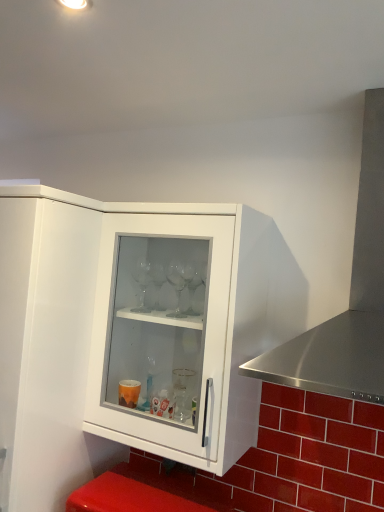
Find the location of a particular element. The height and width of the screenshot is (512, 384). transparent glass cabinet at center is located at coordinates (161, 332).

Find the location of a particular element. The image size is (384, 512). transparent glass cabinet at center is located at coordinates (161, 332).

Between white glossy cabinet at upper left and transparent glass cabinet at center, which one has more height?

white glossy cabinet at upper left.

Are white glossy cabinet at upper left and transparent glass cabinet at center making contact?

No, white glossy cabinet at upper left is not next to transparent glass cabinet at center.

The image size is (384, 512). Identify the location of cupboard below the transparent glass cabinet at center (from a real-world perspective). (45, 347).

Is the depth of white glossy cabinet at upper left greater than that of transparent glass cabinet at center?

No, white glossy cabinet at upper left is in front of transparent glass cabinet at center.

From the image's perspective, which is below, transparent glass cabinet at center or white glossy cabinet at upper left?

white glossy cabinet at upper left, from the image's perspective.

Would you say white glossy cabinet at upper left is part of transparent glass cabinet at center's contents?

No.

Looking at this image, which object is positioned more to the right, transparent glass cabinet at center or white glossy cabinet at upper left?

transparent glass cabinet at center.

Looking at this image, is transparent glass cabinet at center facing away from white glossy cabinet at upper left?

transparent glass cabinet at center does not have its back to white glossy cabinet at upper left.

Based on their positions, is white glossy cabinet at upper left located to the left or right of stainless steel exhaust hood at right?

Clearly, white glossy cabinet at upper left is on the left of stainless steel exhaust hood at right in the image.

Consider the image. Who is smaller, white glossy cabinet at upper left or stainless steel exhaust hood at right?

With smaller size is stainless steel exhaust hood at right.

Which of these two, white glossy cabinet at upper left or stainless steel exhaust hood at right, is wider?

Wider between the two is white glossy cabinet at upper left.

Which is more to the left, transparent glass cabinet at center or stainless steel exhaust hood at right?

transparent glass cabinet at center is more to the left.

From their relative heights in the image, would you say transparent glass cabinet at center is taller or shorter than stainless steel exhaust hood at right?

Considering their sizes, transparent glass cabinet at center has more height than stainless steel exhaust hood at right.

Between transparent glass cabinet at center and stainless steel exhaust hood at right, which one is positioned behind?

transparent glass cabinet at center is behind.

From the image's perspective, which one is positioned higher, stainless steel exhaust hood at right or white glossy cabinet at upper left?

stainless steel exhaust hood at right is shown above in the image.

What's the angular difference between stainless steel exhaust hood at right and white glossy cabinet at upper left's facing directions?

The facing directions of stainless steel exhaust hood at right and white glossy cabinet at upper left are 0.706 degrees apart.

From a real-world perspective, is stainless steel exhaust hood at right on top of white glossy cabinet at upper left?

Yes, from a real-world perspective, stainless steel exhaust hood at right is on top of white glossy cabinet at upper left.

Do you think stainless steel exhaust hood at right is within white glossy cabinet at upper left, or outside of it?

stainless steel exhaust hood at right exists outside the volume of white glossy cabinet at upper left.

In terms of height, does stainless steel exhaust hood at right look taller or shorter compared to transparent glass cabinet at center?

In the image, stainless steel exhaust hood at right appears to be shorter than transparent glass cabinet at center.

Is stainless steel exhaust hood at right in front of or behind transparent glass cabinet at center in the image?

Clearly, stainless steel exhaust hood at right is in front of transparent glass cabinet at center.

Which is in front, point (363, 216) or point (199, 264)?

The point (363, 216) is more forward.

Is stainless steel exhaust hood at right smaller than transparent glass cabinet at center?

Actually, stainless steel exhaust hood at right might be larger than transparent glass cabinet at center.

Locate an element on the screen. Image resolution: width=384 pixels, height=512 pixels. glass door that appears on the right of white glossy cabinet at upper left is located at coordinates (161, 332).

Identify the location of glass door above the white glossy cabinet at upper left (from a real-world perspective). The height and width of the screenshot is (512, 384). (161, 332).

Estimate the real-world distances between objects in this image. Which object is closer to transparent glass cabinet at center, white glossy cabinet at upper left or stainless steel exhaust hood at right?

white glossy cabinet at upper left is closer to transparent glass cabinet at center.

Considering their positions, is stainless steel exhaust hood at right positioned closer to white glossy cabinet at upper left than transparent glass cabinet at center?

The object closer to white glossy cabinet at upper left is transparent glass cabinet at center.

When comparing their distances from transparent glass cabinet at center, does stainless steel exhaust hood at right or white glossy cabinet at upper left seem closer?

white glossy cabinet at upper left is positioned closer to the anchor transparent glass cabinet at center.

Which object lies further to the anchor point white glossy cabinet at upper left, transparent glass cabinet at center or stainless steel exhaust hood at right?

Among the two, stainless steel exhaust hood at right is located further to white glossy cabinet at upper left.

Based on their spatial positions, is white glossy cabinet at upper left or transparent glass cabinet at center further from stainless steel exhaust hood at right?

Among the two, white glossy cabinet at upper left is located further to stainless steel exhaust hood at right.

Considering their positions, is transparent glass cabinet at center positioned further to stainless steel exhaust hood at right than white glossy cabinet at upper left?

white glossy cabinet at upper left lies further to stainless steel exhaust hood at right than the other object.

Where is `glass door between white glossy cabinet at upper left and stainless steel exhaust hood at right`? Image resolution: width=384 pixels, height=512 pixels. glass door between white glossy cabinet at upper left and stainless steel exhaust hood at right is located at coordinates (161, 332).